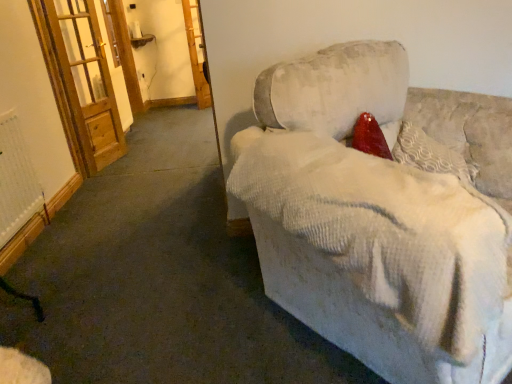
Question: Is wooden screen door at left, positioned as the first screen door in front-to-back order, taller or shorter than textured cream pillow at upper right?

Choices:
 (A) tall
 (B) short

Answer: (A)

Question: From a real-world perspective, is wooden screen door at left, the 1th screen door from the left, positioned above or below textured cream pillow at upper right?

Choices:
 (A) above
 (B) below

Answer: (A)

Question: Based on their relative distances, which object is farther from the white textured radiator at lower left?

Choices:
 (A) velvet beige couch at center
 (B) wooden screen door at upper left, marked as the first screen door in a right-to-left arrangement
 (C) wooden screen door at left, positioned as the first screen door in front-to-back order
 (D) textured cream pillow at upper right

Answer: (B)

Question: Which object is positioned farthest from the wooden screen door at left, positioned as the 2th screen door in back-to-front order?

Choices:
 (A) textured cream pillow at upper right
 (B) white textured radiator at lower left
 (C) velvet beige couch at center
 (D) wooden screen door at upper left, placed as the first screen door when sorted from back to front

Answer: (A)